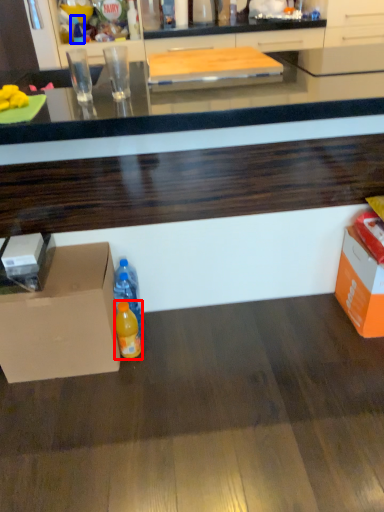
Question: Which object is further to the camera taking this photo, bottle (highlighted by a red box) or bottle (highlighted by a blue box)?

Choices:
 (A) bottle
 (B) bottle

Answer: (B)